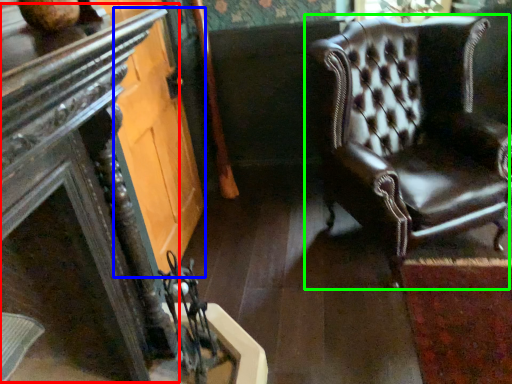
Question: Estimate the real-world distances between objects in this image. Which object is closer to table (highlighted by a red box), glass door (highlighted by a blue box) or chair (highlighted by a green box)?

Choices:
 (A) glass door
 (B) chair

Answer: (A)